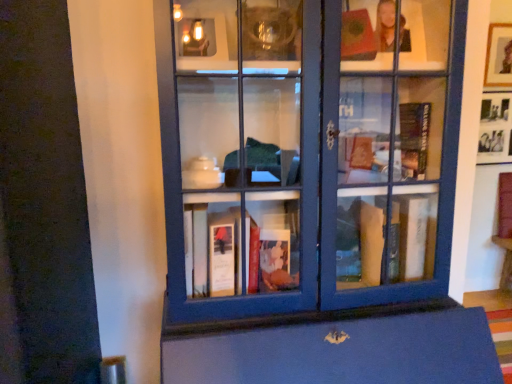
Question: In terms of width, does matte blue bookcase at center look wider or thinner when compared to wooden picture frame at upper right, which is counted as the second picture frame, starting from the bottom?

Choices:
 (A) wide
 (B) thin

Answer: (A)

Question: Based on their sizes in the image, would you say matte blue bookcase at center is bigger or smaller than wooden picture frame at upper right, the 1th picture frame in the top-to-bottom sequence?

Choices:
 (A) big
 (B) small

Answer: (A)

Question: Which of these objects is positioned closest to the black matte picture frame at upper right, arranged as the first picture frame when ordered from the bottom?

Choices:
 (A) matte blue bookcase at center
 (B) wooden picture frame at upper right, which is counted as the second picture frame, starting from the bottom

Answer: (B)

Question: Based on their relative distances, which object is nearer to the black matte picture frame at upper right, arranged as the first picture frame when ordered from the bottom?

Choices:
 (A) wooden picture frame at upper right, which is counted as the second picture frame, starting from the bottom
 (B) matte blue bookcase at center

Answer: (A)